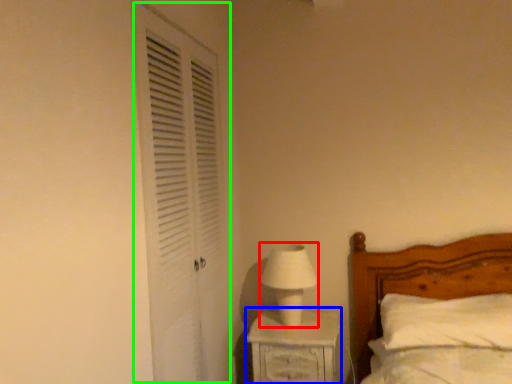
Question: Based on their relative distances, which object is nearer to table lamp (highlighted by a red box)? Choose from nightstand (highlighted by a blue box) and screen door (highlighted by a green box).

Choices:
 (A) nightstand
 (B) screen door

Answer: (A)